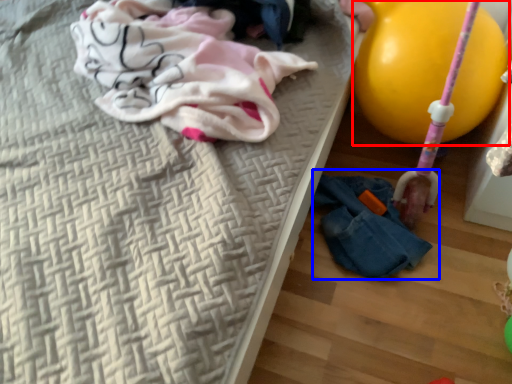
Question: Among these objects, which one is nearest to the camera, balloon (highlighted by a red box) or woman (highlighted by a blue box)?

Choices:
 (A) balloon
 (B) woman

Answer: (A)